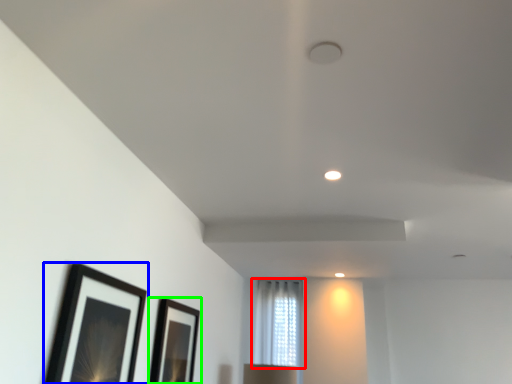
Question: Which object is positioned closest to window (highlighted by a red box)? Select from picture frame (highlighted by a blue box) and picture frame (highlighted by a green box).

Choices:
 (A) picture frame
 (B) picture frame

Answer: (B)